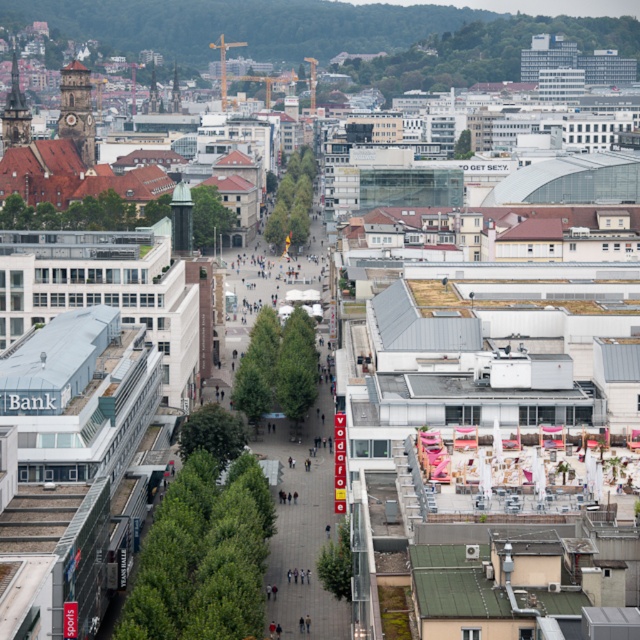
Is brown stone clock tower at upper left taller than dark brown stone tower at upper left?

Incorrect, brown stone clock tower at upper left's height is not larger of dark brown stone tower at upper left's.

Is point (61, 68) in front of point (8, 116)?

That is False.

Between point (72, 97) and point (17, 131), which one is positioned behind?

The point (72, 97) is more distant.

Find the location of a particular element. The image size is (640, 640). brown stone clock tower at upper left is located at coordinates (76, 109).